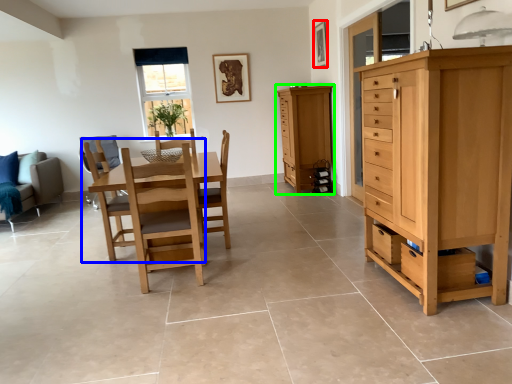
Question: Which is nearer to the picture frame (highlighted by a red box)? chair (highlighted by a blue box) or cabinetry (highlighted by a green box).

Choices:
 (A) chair
 (B) cabinetry

Answer: (B)